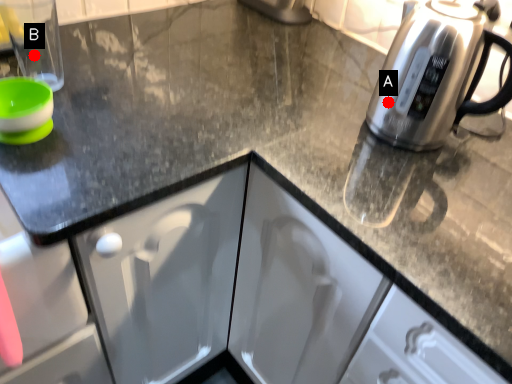
Question: Two points are circled on the image, labeled by A and B beside each circle. Which point is closer to the camera?

Choices:
 (A) A is closer
 (B) B is closer

Answer: (A)